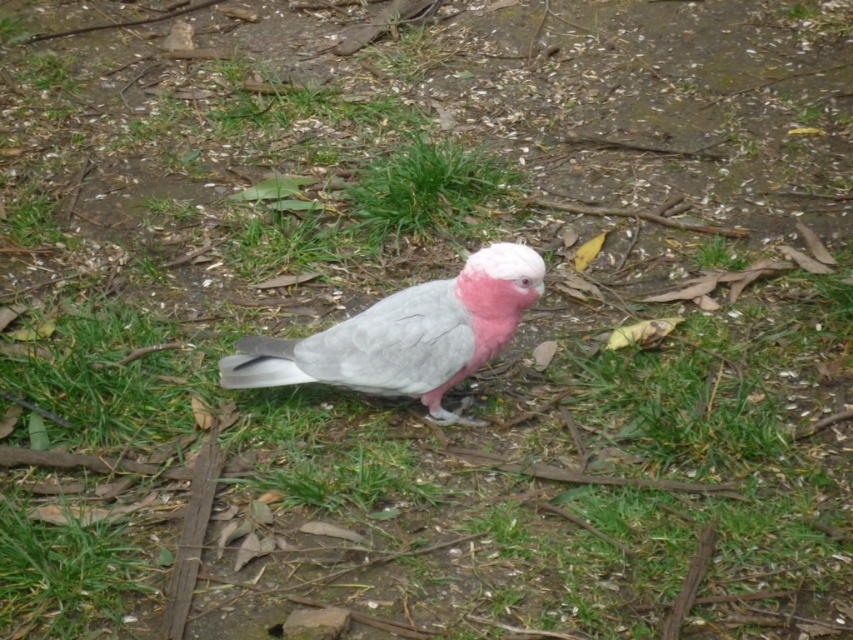
Does gray matte parrot at center have a greater width compared to green leafy grass at center?

Indeed, gray matte parrot at center has a greater width compared to green leafy grass at center.

Which is below, gray matte parrot at center or green leafy grass at center?

gray matte parrot at center is lower down.

You are a GUI agent. You are given a task and a screenshot of the screen. Output one action in this format:
    pyautogui.click(x=<x>, y=<y>)
    Task: Click on the gray matte parrot at center
    The height and width of the screenshot is (640, 853).
    Given the screenshot: What is the action you would take?
    pyautogui.click(x=405, y=336)

Where is `gray matte parrot at center`? The width and height of the screenshot is (853, 640). gray matte parrot at center is located at coordinates (405, 336).